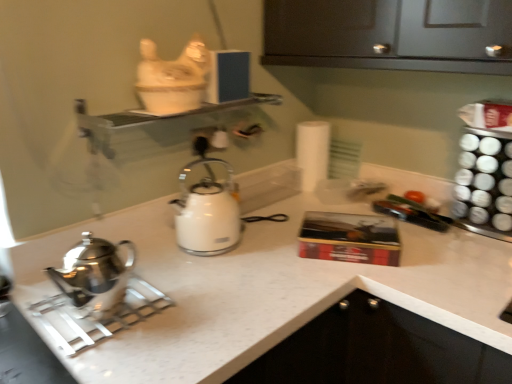
Describe the element at coordinates (207, 212) in the screenshot. I see `white glossy kettle at center, the 1th kettle from the right` at that location.

The width and height of the screenshot is (512, 384). What are the coordinates of `white glossy kettle at center, the second kettle from the left` in the screenshot? It's located at (207, 212).

The height and width of the screenshot is (384, 512). What do you see at coordinates (164, 126) in the screenshot? I see `clear glass shelf at upper center` at bounding box center [164, 126].

Locate an element on the screen. white matte toilet paper at center is located at coordinates (312, 152).

Image resolution: width=512 pixels, height=384 pixels. Describe the element at coordinates (312, 152) in the screenshot. I see `white matte toilet paper at center` at that location.

What do you see at coordinates (95, 275) in the screenshot? This screenshot has height=384, width=512. I see `polished stainless steel kettle at left, acting as the first kettle starting from the left` at bounding box center [95, 275].

The height and width of the screenshot is (384, 512). In order to click on white glossy kettle at center, positioned as the first kettle in back-to-front order in this screenshot , I will do `click(207, 212)`.

Which of these two, polished stainless steel kettle at left, which is the first kettle from front to back, or white glossy kettle at center, the 1th kettle from the right, is thinner?

With smaller width is polished stainless steel kettle at left, which is the first kettle from front to back.

From the image's perspective, is polished stainless steel kettle at left, acting as the first kettle starting from the left, beneath white glossy kettle at center, positioned as the first kettle in back-to-front order?

Yes, from the image's perspective, polished stainless steel kettle at left, acting as the first kettle starting from the left, is beneath white glossy kettle at center, positioned as the first kettle in back-to-front order.

From the picture: In terms of height, does polished stainless steel kettle at left, which is the first kettle from front to back, look taller or shorter compared to white glossy kettle at center, the second kettle from the left?

In the image, polished stainless steel kettle at left, which is the first kettle from front to back, appears to be shorter than white glossy kettle at center, the second kettle from the left.

Are clear glass shelf at upper center and white glossy kettle at center, the 1th kettle from the right, far apart?

clear glass shelf at upper center is near white glossy kettle at center, the 1th kettle from the right, not far away.

Is clear glass shelf at upper center oriented away from white glossy kettle at center, positioned as the first kettle in back-to-front order?

No.

Is clear glass shelf at upper center thinner than white glossy kettle at center, the 1th kettle from the right?

Indeed, clear glass shelf at upper center has a lesser width compared to white glossy kettle at center, the 1th kettle from the right.

From their relative heights in the image, would you say clear glass shelf at upper center is taller or shorter than white glossy kettle at center, the second kettle from the left?

clear glass shelf at upper center is shorter than white glossy kettle at center, the second kettle from the left.

Relative to clear glass shelf at upper center, is polished stainless steel kettle at left, acting as the first kettle starting from the left, in front or behind?

Visually, polished stainless steel kettle at left, acting as the first kettle starting from the left, is located in front of clear glass shelf at upper center.

How many degrees apart are the facing directions of polished stainless steel kettle at left, the second kettle when ordered from right to left, and clear glass shelf at upper center?

The angle between the facing direction of polished stainless steel kettle at left, the second kettle when ordered from right to left, and the facing direction of clear glass shelf at upper center is 0.0042 degrees.

Is point (82, 247) farther from viewer compared to point (104, 131)?

That is False.

From a real-world perspective, is polished stainless steel kettle at left, the second kettle when ordered from right to left, over clear glass shelf at upper center?

Incorrect, from a real-world perspective, polished stainless steel kettle at left, the second kettle when ordered from right to left, is lower than clear glass shelf at upper center.

Could you measure the distance between white glossy kettle at center, which is the 2th kettle from front to back, and clear glass shelf at upper center?

They are 9.20 inches apart.

Considering the sizes of objects white glossy kettle at center, positioned as the first kettle in back-to-front order, and clear glass shelf at upper center in the image provided, who is smaller, white glossy kettle at center, positioned as the first kettle in back-to-front order, or clear glass shelf at upper center?

With smaller size is clear glass shelf at upper center.

From a real-world perspective, who is located higher, white glossy kettle at center, the 1th kettle from the right, or clear glass shelf at upper center?

clear glass shelf at upper center.

Does white glossy kettle at center, positioned as the first kettle in back-to-front order, come behind clear glass shelf at upper center?

Yes, the depth of white glossy kettle at center, positioned as the first kettle in back-to-front order, is greater than that of clear glass shelf at upper center.

Consider the image. From a real-world perspective, between polished stainless steel kettle at left, the second kettle positioned from the back, and white matte toilet paper at center, who is vertically higher?

white matte toilet paper at center.

Does point (83, 295) lie in front of point (307, 132)?

That is True.

Between polished stainless steel kettle at left, which is the first kettle from front to back, and white matte toilet paper at center, which one is positioned behind?

Positioned behind is white matte toilet paper at center.

Is polished stainless steel kettle at left, which is the first kettle from front to back, positioned beyond the bounds of white matte toilet paper at center?

Yes.

What are the coordinates of `toilet paper located behind the white glossy kettle at center, the 1th kettle from the right` in the screenshot? It's located at (312, 152).

In terms of height, does white glossy kettle at center, the 1th kettle from the right, look taller or shorter compared to white matte toilet paper at center?

white glossy kettle at center, the 1th kettle from the right, is shorter than white matte toilet paper at center.

Is white glossy kettle at center, the second kettle from the left, touching white matte toilet paper at center?

white glossy kettle at center, the second kettle from the left, and white matte toilet paper at center are clearly separated.

Do you think white glossy kettle at center, the second kettle from the left, is within white matte toilet paper at center, or outside of it?

white glossy kettle at center, the second kettle from the left, is located beyond the bounds of white matte toilet paper at center.

Could you tell me if white matte toilet paper at center is turned towards polished stainless steel kettle at left, the second kettle positioned from the back?

No, white matte toilet paper at center does not turn towards polished stainless steel kettle at left, the second kettle positioned from the back.

Between white matte toilet paper at center and polished stainless steel kettle at left, which is the first kettle from front to back, which one has larger width?

Wider between the two is white matte toilet paper at center.

Which is in front, point (301, 163) or point (84, 287)?

The point (84, 287) is closer.

Which object is closer to the camera, white matte toilet paper at center or polished stainless steel kettle at left, the second kettle when ordered from right to left?

polished stainless steel kettle at left, the second kettle when ordered from right to left, is closer to the camera.

The image size is (512, 384). In order to click on kettle below the white glossy kettle at center, the second kettle from the left (from the image's perspective) in this screenshot , I will do `click(95, 275)`.

Find the location of `shelf on the left of white glossy kettle at center, positioned as the first kettle in back-to-front order`. shelf on the left of white glossy kettle at center, positioned as the first kettle in back-to-front order is located at coordinates (164, 126).

From the image, which object appears to be nearer to white matte toilet paper at center, white glossy kettle at center, which is the 2th kettle from front to back, or clear glass shelf at upper center?

clear glass shelf at upper center is positioned closer to the anchor white matte toilet paper at center.

Based on their spatial positions, is white matte toilet paper at center or white glossy kettle at center, which is the 2th kettle from front to back, closer to polished stainless steel kettle at left, the second kettle positioned from the back?

Among the two, white glossy kettle at center, which is the 2th kettle from front to back, is located nearer to polished stainless steel kettle at left, the second kettle positioned from the back.

Consider the image. From the image, which object appears to be nearer to polished stainless steel kettle at left, the second kettle when ordered from right to left, white matte toilet paper at center or clear glass shelf at upper center?

clear glass shelf at upper center.

In the scene shown: Which object lies nearer to the anchor point clear glass shelf at upper center, white matte toilet paper at center or white glossy kettle at center, the second kettle from the left?

Based on the image, white glossy kettle at center, the second kettle from the left, appears to be nearer to clear glass shelf at upper center.

Which object lies further to the anchor point white glossy kettle at center, positioned as the first kettle in back-to-front order, polished stainless steel kettle at left, the second kettle positioned from the back, or white matte toilet paper at center?

The object further to white glossy kettle at center, positioned as the first kettle in back-to-front order, is white matte toilet paper at center.

Estimate the real-world distances between objects in this image. Which object is further from white glossy kettle at center, the 1th kettle from the right, clear glass shelf at upper center or polished stainless steel kettle at left, the second kettle when ordered from right to left?

polished stainless steel kettle at left, the second kettle when ordered from right to left, is positioned further to the anchor white glossy kettle at center, the 1th kettle from the right.

From the image, which object appears to be farther from polished stainless steel kettle at left, acting as the first kettle starting from the left, clear glass shelf at upper center or white matte toilet paper at center?

white matte toilet paper at center is positioned further to the anchor polished stainless steel kettle at left, acting as the first kettle starting from the left.

Considering their positions, is clear glass shelf at upper center positioned further to white matte toilet paper at center than polished stainless steel kettle at left, acting as the first kettle starting from the left?

The object further to white matte toilet paper at center is polished stainless steel kettle at left, acting as the first kettle starting from the left.

This screenshot has width=512, height=384. What are the coordinates of `kettle between clear glass shelf at upper center and polished stainless steel kettle at left, the second kettle positioned from the back, from top to bottom` in the screenshot? It's located at (207, 212).

Locate an element on the screen. Image resolution: width=512 pixels, height=384 pixels. kettle located between clear glass shelf at upper center and white matte toilet paper at center in the depth direction is located at coordinates (207, 212).

Where is `kettle between polished stainless steel kettle at left, which is the first kettle from front to back, and white matte toilet paper at center from front to back`? kettle between polished stainless steel kettle at left, which is the first kettle from front to back, and white matte toilet paper at center from front to back is located at coordinates (207, 212).

Image resolution: width=512 pixels, height=384 pixels. What are the coordinates of `shelf positioned between polished stainless steel kettle at left, the second kettle when ordered from right to left, and white matte toilet paper at center from near to far` in the screenshot? It's located at (164, 126).